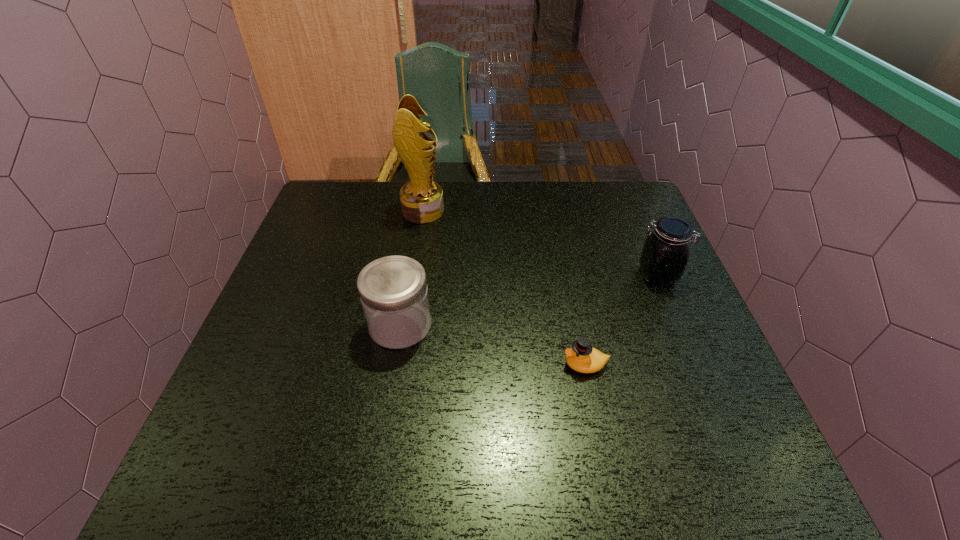
This screenshot has width=960, height=540. Find the location of `free spot at the right edge of the desktop`. free spot at the right edge of the desktop is located at coordinates (643, 346).

I want to click on vacant space at the far left corner, so click(357, 212).

Find the location of a particular element. This screenshot has width=960, height=540. vacant space at the far right corner is located at coordinates (593, 199).

At what (x,y) coordinates should I click in order to perform the action: click on free space between the left jar and the nearest object. Please return your answer as a coordinate pair (x, y). This screenshot has width=960, height=540. Looking at the image, I should click on (492, 345).

Locate an element on the screen. This screenshot has height=540, width=960. unoccupied area between the left jar and the right jar is located at coordinates (529, 300).

I want to click on vacant area between the award and the duck, so tap(504, 288).

At what (x,y) coordinates should I click in order to perform the action: click on free space between the award and the right jar. Please return your answer as a coordinate pair (x, y). This screenshot has width=960, height=540. Looking at the image, I should click on pyautogui.click(x=540, y=243).

Locate an element on the screen. The width and height of the screenshot is (960, 540). empty space between the nearer jar and the nearest object is located at coordinates (492, 345).

This screenshot has width=960, height=540. What are the coordinates of `free space between the duck and the second nearest object` in the screenshot? It's located at (492, 345).

This screenshot has height=540, width=960. Identify the location of vacant point located between the rightmost object and the tallest object. (540, 243).